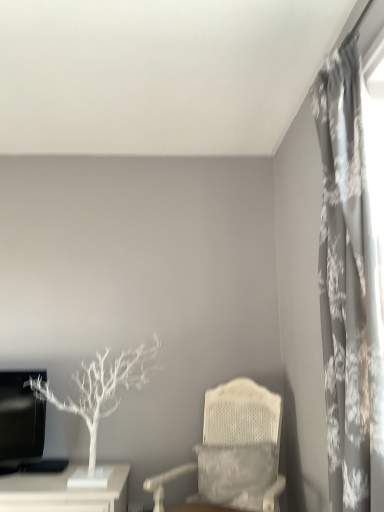
Question: Can you confirm if white textured chair at center is smaller than white matte tree at left?

Choices:
 (A) no
 (B) yes

Answer: (A)

Question: Is white textured chair at center wider than white matte tree at left?

Choices:
 (A) yes
 (B) no

Answer: (A)

Question: Is white textured chair at center at the right side of white matte tree at left?

Choices:
 (A) yes
 (B) no

Answer: (A)

Question: Is white textured chair at center further to the viewer compared to white matte tree at left?

Choices:
 (A) no
 (B) yes

Answer: (A)

Question: Is white textured chair at center closer to camera compared to white matte tree at left?

Choices:
 (A) yes
 (B) no

Answer: (A)

Question: In terms of height, does white textured chair at center look taller or shorter compared to gray floral fabric curtain at right?

Choices:
 (A) tall
 (B) short

Answer: (B)

Question: From the image's perspective, relative to gray floral fabric curtain at right, is white textured chair at center above or below?

Choices:
 (A) above
 (B) below

Answer: (B)

Question: Considering the positions of white textured chair at center and gray floral fabric curtain at right in the image, is white textured chair at center wider or thinner than gray floral fabric curtain at right?

Choices:
 (A) thin
 (B) wide

Answer: (B)

Question: Would you say white textured chair at center is to the left or to the right of gray floral fabric curtain at right in the picture?

Choices:
 (A) left
 (B) right

Answer: (A)

Question: From a real-world perspective, is white matte table at lower left physically located above or below gray floral fabric curtain at right?

Choices:
 (A) above
 (B) below

Answer: (B)

Question: From the image's perspective, is white matte table at lower left located above or below gray floral fabric curtain at right?

Choices:
 (A) below
 (B) above

Answer: (A)

Question: Considering the positions of white matte table at lower left and gray floral fabric curtain at right in the image, is white matte table at lower left bigger or smaller than gray floral fabric curtain at right?

Choices:
 (A) big
 (B) small

Answer: (B)

Question: Is point (36, 482) positioned closer to the camera than point (355, 359)?

Choices:
 (A) closer
 (B) farther

Answer: (B)

Question: Is white matte tree at left situated inside gray floral fabric curtain at right or outside?

Choices:
 (A) inside
 (B) outside

Answer: (B)

Question: Considering their positions, is white matte tree at left located in front of or behind gray floral fabric curtain at right?

Choices:
 (A) behind
 (B) front

Answer: (A)